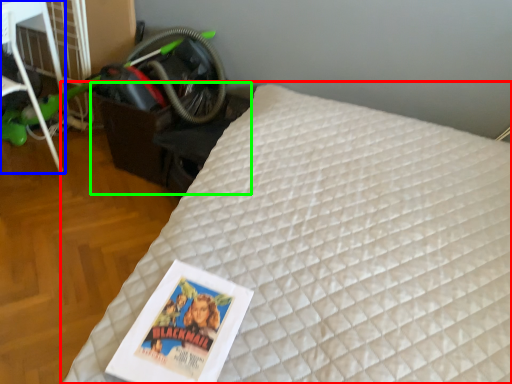
Question: Which is farther away from bed (highlighted by a red box)? furniture (highlighted by a blue box) or table (highlighted by a green box)?

Choices:
 (A) furniture
 (B) table

Answer: (A)